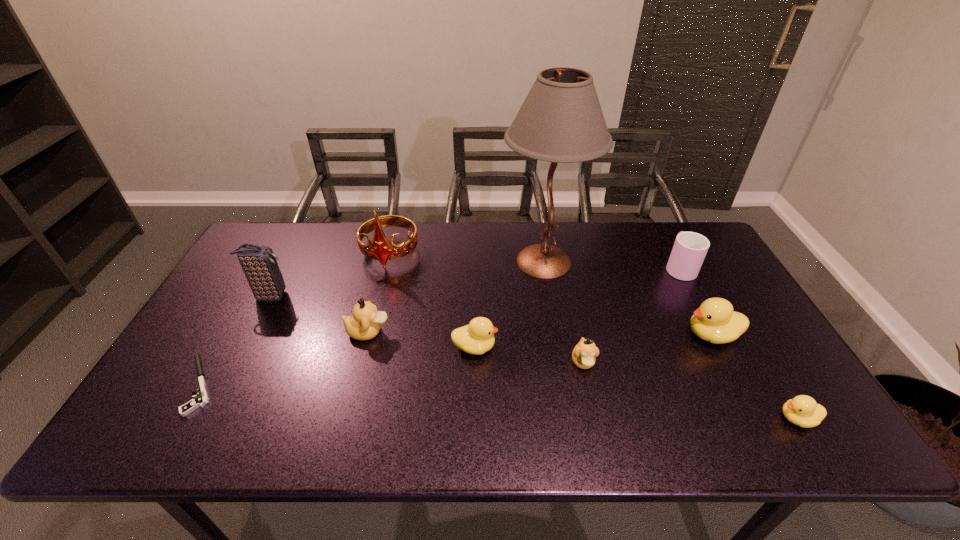
This screenshot has width=960, height=540. Find the location of `free spot between the tiara and the bigger tan duckling`. free spot between the tiara and the bigger tan duckling is located at coordinates (379, 293).

This screenshot has height=540, width=960. What are the coordinates of `blank region between the biggest yellow duckling and the clutch bag` in the screenshot? It's located at (491, 315).

Identify the location of unoccupied position between the clutch bag and the smallest yellow duckling. (534, 357).

Locate an element on the screen. vacant space that's between the nearest yellow duckling and the leftmost duckling is located at coordinates (583, 375).

At what (x,y) coordinates should I click in order to perform the action: click on free spot between the black pistol and the ninth shortest object. Please return your answer as a coordinate pair (x, y). The width and height of the screenshot is (960, 540). Looking at the image, I should click on (295, 319).

At what (x,y) coordinates should I click in order to perform the action: click on empty space between the cup and the leftmost duckling. Please return your answer as a coordinate pair (x, y). Image resolution: width=960 pixels, height=540 pixels. Looking at the image, I should click on (523, 300).

You are a GUI agent. You are given a task and a screenshot of the screen. Output one action in this format:
    pyautogui.click(x=<x>, y=<y>)
    Task: Click on the vacant area that lies between the bigger tan duckling and the nearest duckling
    This screenshot has width=960, height=540.
    Given the screenshot: What is the action you would take?
    pyautogui.click(x=583, y=375)

Select which object is the eighth closest to the smallest yellow duckling. Please provide its 2D coordinates. Your answer should be formatted as a tuple, i.e. [(x, y)], where the tuple contains the x and y coordinates of a point satisfying the conditions above.

[(259, 264)]

You are a GUI agent. You are given a task and a screenshot of the screen. Output one action in this format:
    pyautogui.click(x=<x>, y=<y>)
    Task: Click on the object identified as the eighth closest to the tallest object
    This screenshot has height=540, width=960.
    Given the screenshot: What is the action you would take?
    pyautogui.click(x=259, y=264)

This screenshot has height=540, width=960. Find the location of `duckling that can be found as the second closest to the cup`. duckling that can be found as the second closest to the cup is located at coordinates (584, 354).